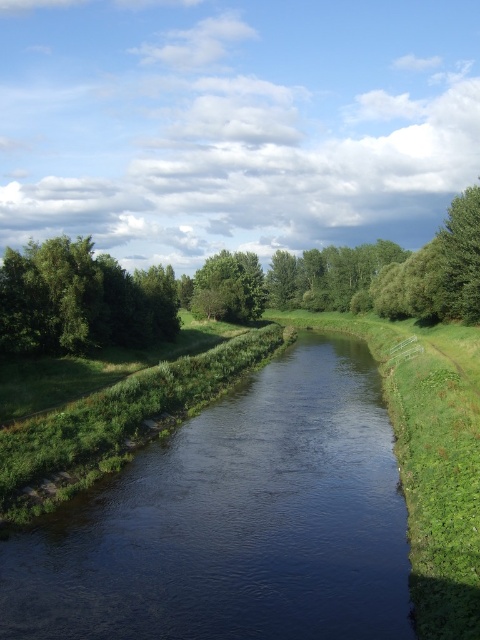
Question: Which object appears closest to the camera in this image?

Choices:
 (A) dark water at center
 (B) green leafy tree at upper left
 (C) green leafy tree at left

Answer: (A)

Question: Can you confirm if dark water at center is positioned to the right of green leafy tree at upper left?

Choices:
 (A) yes
 (B) no

Answer: (B)

Question: Where is green leafy tree at upper left located in relation to green leafy tree at left in the image?

Choices:
 (A) above
 (B) below

Answer: (A)

Question: Can you confirm if green leafy tree at upper left is positioned below green leafy tree at center?

Choices:
 (A) no
 (B) yes

Answer: (B)

Question: Based on their relative distances, which object is nearer to the green leafy tree at upper left?

Choices:
 (A) green leafy tree at center
 (B) green leafy tree at left
 (C) dark water at center

Answer: (A)

Question: Which of the following is the farthest from the observer?

Choices:
 (A) green leafy tree at center
 (B) green leafy tree at upper left
 (C) dark water at center

Answer: (A)